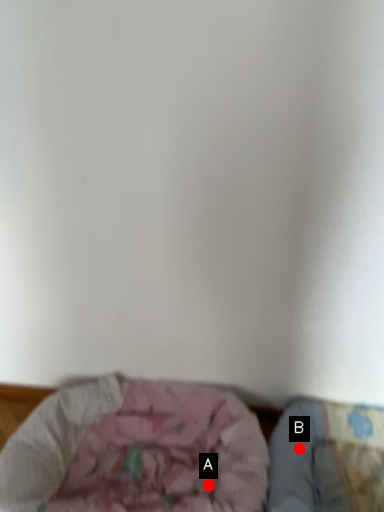
Question: Two points are circled on the image, labeled by A and B beside each circle. Which point appears farthest from the camera in this image?

Choices:
 (A) A is further
 (B) B is further

Answer: (B)